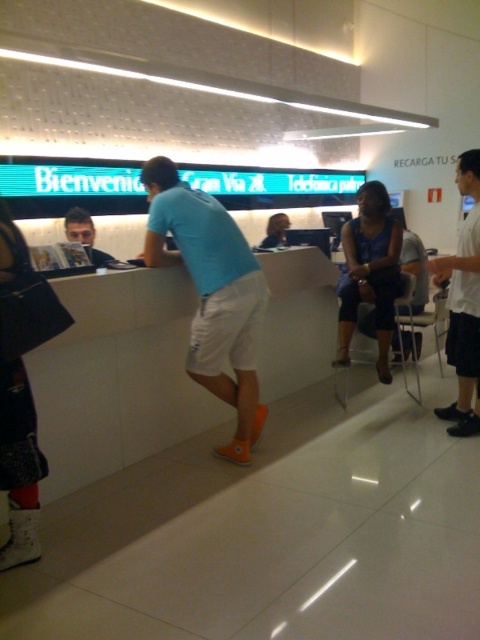
Does point (459, 369) lie in front of point (68, 221)?

Yes, it is.

Is white short pants at right taller than matte black book at left?

Yes.

Find the location of a particular element. This screenshot has height=640, width=480. white short pants at right is located at coordinates (463, 304).

This screenshot has width=480, height=640. I want to click on white short pants at right, so click(463, 304).

Does light blue fabric shirt at center appear over white short pants at right?

No, light blue fabric shirt at center is not above white short pants at right.

Is light blue fabric shirt at center bigger than white short pants at right?

Correct, light blue fabric shirt at center is larger in size than white short pants at right.

At what (x,y) coordinates should I click in order to perform the action: click on light blue fabric shirt at center. Please return your answer as a coordinate pair (x, y). The width and height of the screenshot is (480, 640). Looking at the image, I should click on (212, 292).

Locate an element on the screen. Image resolution: width=480 pixels, height=640 pixels. light blue fabric shirt at center is located at coordinates (212, 292).

Which of these two, blue fabric dress at center or white short pants at right, stands shorter?

blue fabric dress at center

Can you confirm if blue fabric dress at center is smaller than white short pants at right?

Correct, blue fabric dress at center occupies less space than white short pants at right.

Who is more distant from viewer, [392,305] or [451,326]?

Positioned behind is point [392,305].

Image resolution: width=480 pixels, height=640 pixels. Identify the location of blue fabric dress at center. (371, 273).